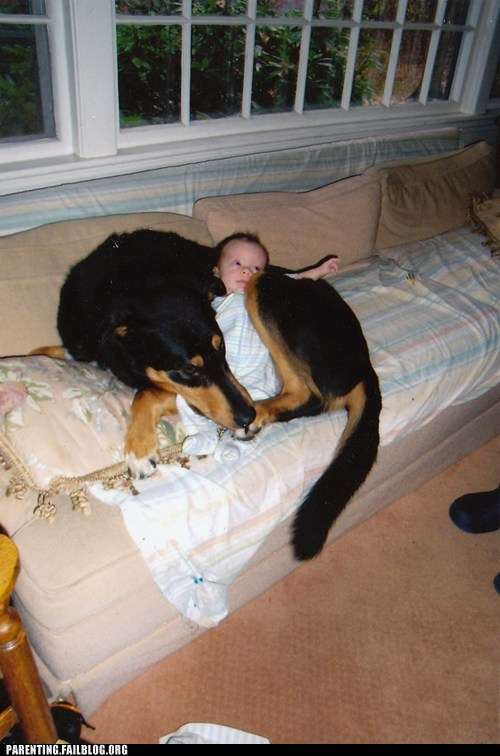
Find the location of a particular element. setee is located at coordinates (101, 535).